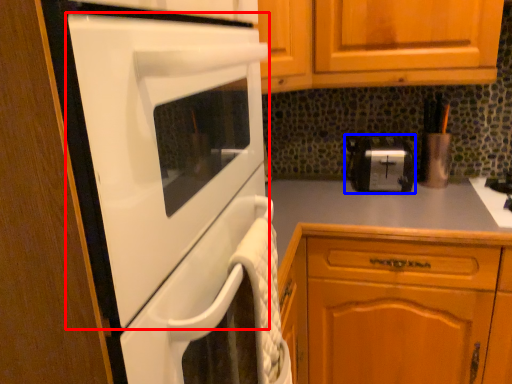
Question: Which object is closer to the camera taking this photo, home appliance (highlighted by a red box) or toaster (highlighted by a blue box)?

Choices:
 (A) home appliance
 (B) toaster

Answer: (A)